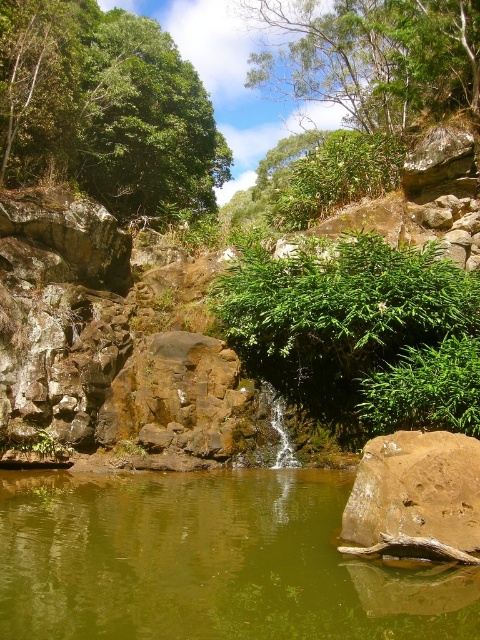
You are a hiker trying to find the best spot to take a photo of the green leafy bush at center and the green leafy tree at upper center. Which one is closer to the camera, and why?

The green leafy bush at center is closer to the camera because it is positioned in the center of the scene, while the green leafy tree at upper center is further away, located at the upper part of the image. Since the bush is smaller in size compared to the tree, this also indicates it is nearer to the viewer.

You are an environmental scientist observing the scene. You need to determine which of the two plants, the green leafy bush at center or the green leafy tree at upper center, is shorter. Based on the description, which one is shorter?

The green leafy bush at center is not as tall as the green leafy tree at upper center, so the green leafy bush at center is shorter.